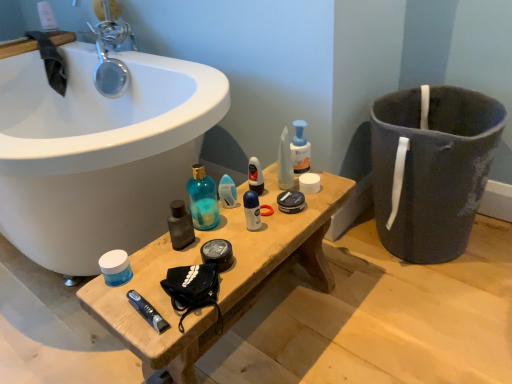
What are the coordinates of `empty space that is ontop of wooden bench at center (from a real-world perspective)` in the screenshot? It's located at (240, 222).